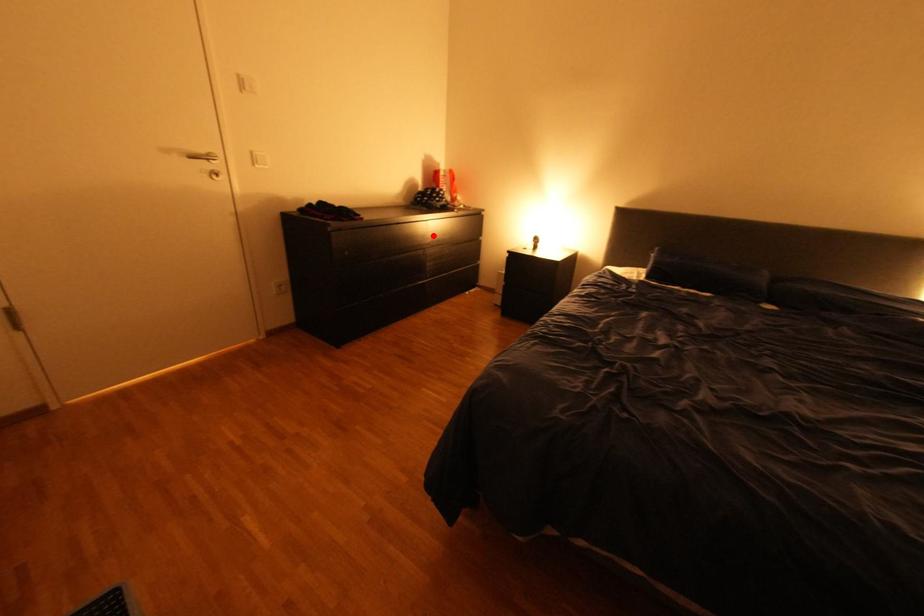
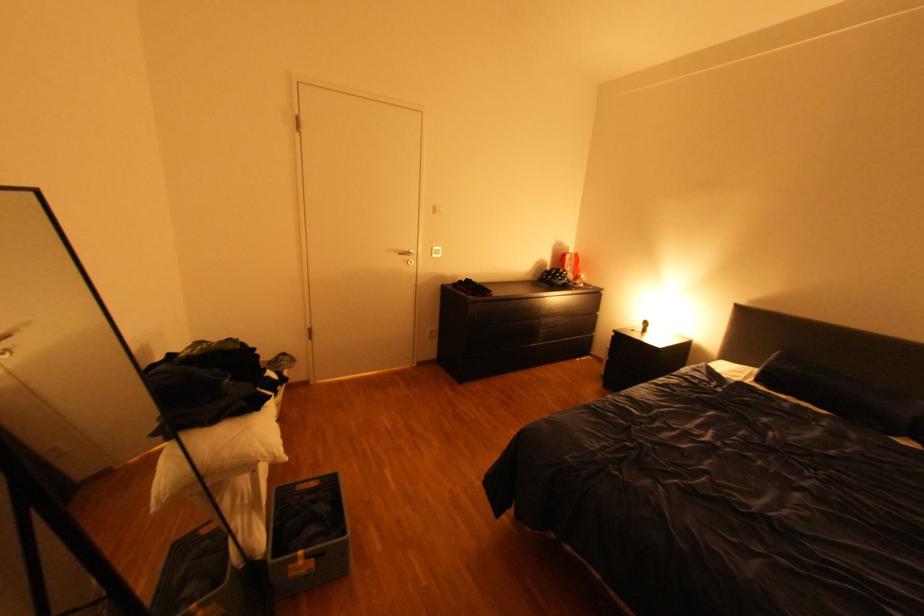
Question: I am providing you with two images of the same scene from different viewpoints. In image1, a red point is highlighted. Considering the same 3D point in image2, which of the following is correct?

Choices:
 (A) It is closer
 (B) It is farther

Answer: (B)